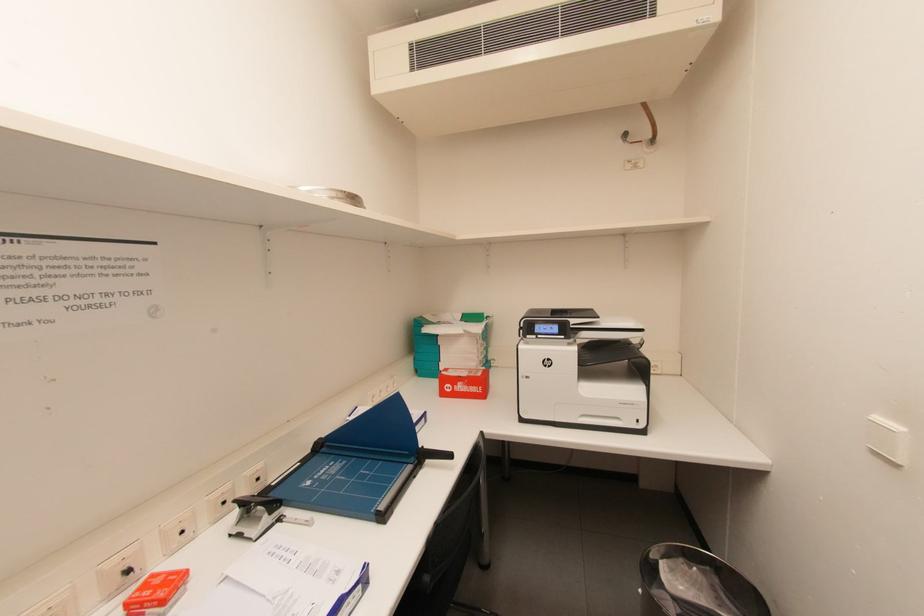
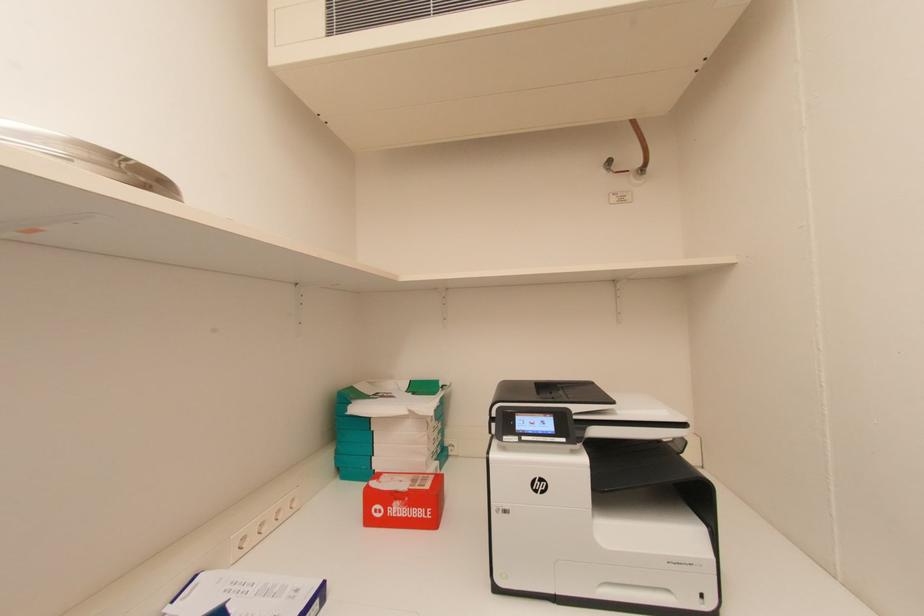
Question: The images are taken continuously from a first-person perspective. In which direction is your viewpoint rotating?

Choices:
 (A) Left
 (B) Right
 (C) Up
 (D) Down

Answer: (C)